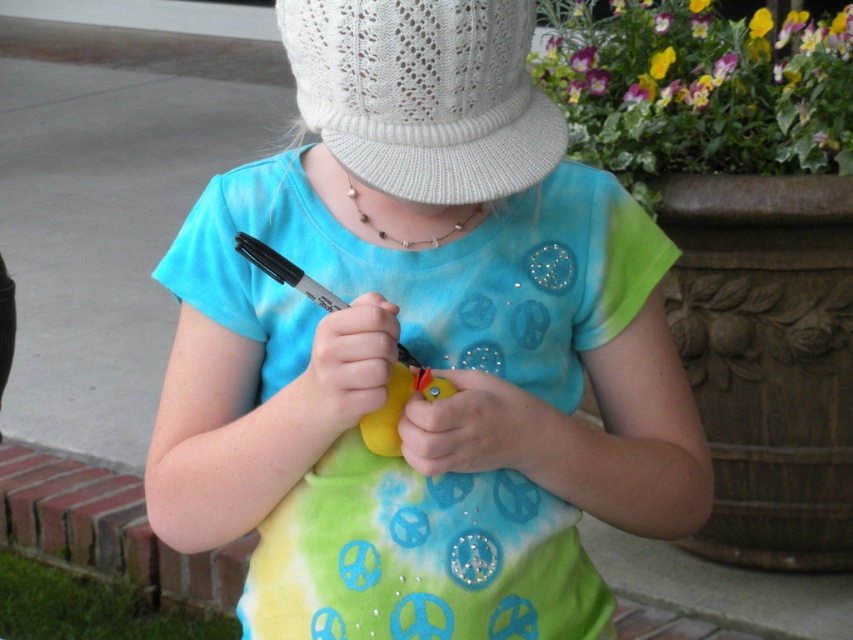
Question: Which point is farther to the camera?

Choices:
 (A) (471, 156)
 (B) (692, 465)

Answer: (B)

Question: Which object appears farthest from the camera in this image?

Choices:
 (A) white knitted hat at center
 (B) matte plastic rubber duck at center

Answer: (B)

Question: Does matte plastic rubber duck at center have a greater width compared to white knitted hat at center?

Choices:
 (A) no
 (B) yes

Answer: (B)

Question: Is matte plastic rubber duck at center thinner than white knitted hat at center?

Choices:
 (A) no
 (B) yes

Answer: (A)

Question: Does matte plastic rubber duck at center have a greater width compared to white knitted hat at center?

Choices:
 (A) yes
 (B) no

Answer: (A)

Question: Among these points, which one is nearest to the camera?

Choices:
 (A) tap(338, 630)
 (B) tap(468, 48)

Answer: (B)